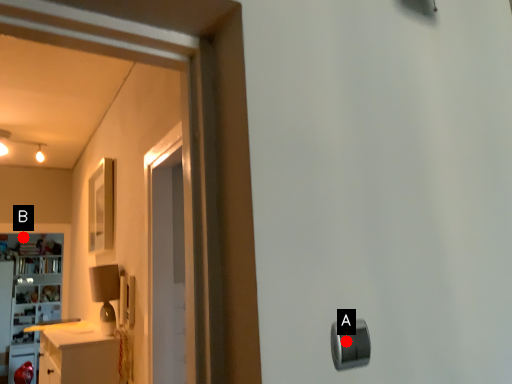
Question: Two points are circled on the image, labeled by A and B beside each circle. Among these points, which one is farthest from the camera?

Choices:
 (A) A is further
 (B) B is further

Answer: (B)